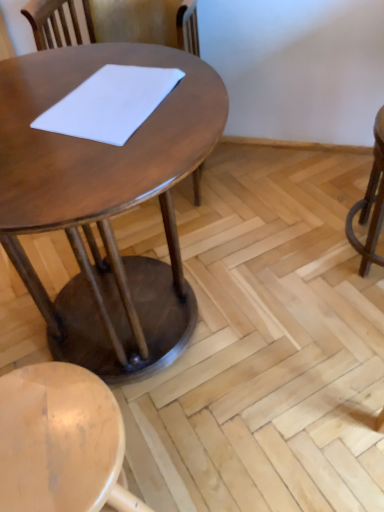
This screenshot has height=512, width=384. Find the location of `free spot in front of white matte notepad at center`. free spot in front of white matte notepad at center is located at coordinates (101, 166).